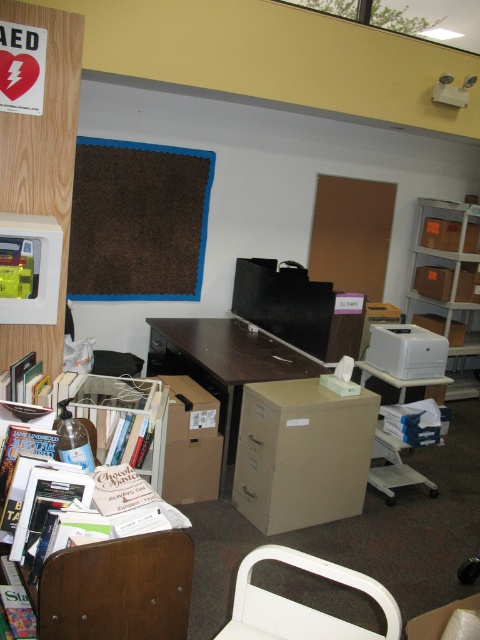
Question: Based on their relative distances, which object is farther from the brown felt bulletin board at upper left?

Choices:
 (A) matte cardboard bookshelf at right
 (B) beige cardboard file cabinet at center
 (C) white plastic chair at lower center
 (D) white matte printer at center right

Answer: (C)

Question: Among these objects, which one is nearest to the camera?

Choices:
 (A) beige cardboard file cabinet at center
 (B) brown felt bulletin board at upper left
 (C) metallic silver bookshelf at lower left

Answer: (C)

Question: Which point appears farthest from the camera in this image?

Choices:
 (A) (170, 160)
 (B) (304, 502)
 (C) (441, 262)

Answer: (C)

Question: Can you confirm if beige cardboard file cabinet at center is smaller than brown cardboard file cabinet at center?

Choices:
 (A) yes
 (B) no

Answer: (A)

Question: Is brown felt bulletin board at upper left above beige cardboard file cabinet at center?

Choices:
 (A) yes
 (B) no

Answer: (A)

Question: Does matte cardboard bookshelf at right appear on the left side of white matte printer at center right?

Choices:
 (A) yes
 (B) no

Answer: (B)